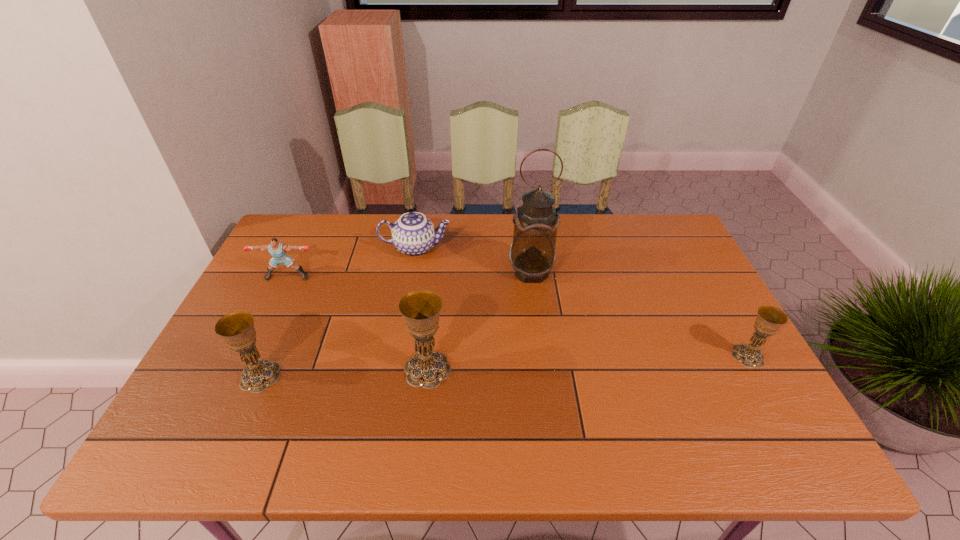
This screenshot has width=960, height=540. I want to click on the second shortest chalice, so click(237, 329).

Image resolution: width=960 pixels, height=540 pixels. I want to click on the third tallest object, so click(237, 329).

Find the location of `the tallest chalice`. the tallest chalice is located at coordinates (420, 309).

Locate an element on the screen. This screenshot has width=960, height=540. the fifth shortest object is located at coordinates (420, 309).

The width and height of the screenshot is (960, 540). What are the coordinates of `the rightmost chalice` in the screenshot? It's located at (769, 319).

The height and width of the screenshot is (540, 960). Find the location of `the rightmost object`. the rightmost object is located at coordinates (769, 319).

Find the location of a particular element. The height and width of the screenshot is (540, 960). chinaware is located at coordinates (413, 234).

I want to click on puncher, so click(277, 249).

What are the coordinates of `the tallest object` in the screenshot? It's located at point(532,254).

This screenshot has height=540, width=960. Find the location of `the second object from right to left`. the second object from right to left is located at coordinates (532, 254).